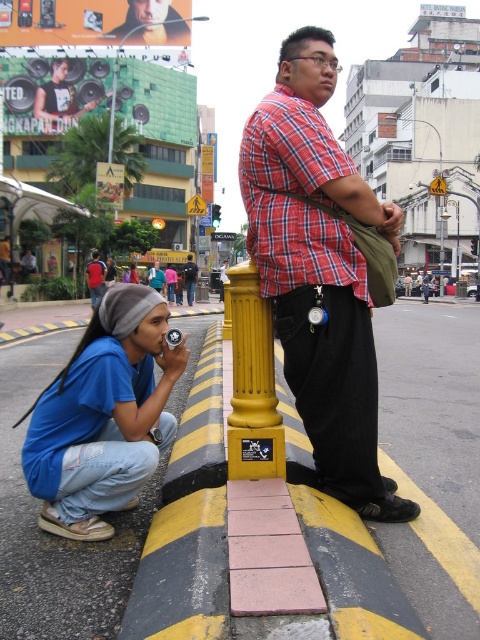
Does point (186, 424) come behind point (154, 266)?

No, it is in front of (154, 266).

Who is taller, yellow/black striped curb at lower left or blue denim jacket at lower left?

With more height is blue denim jacket at lower left.

You are a GUI agent. You are given a task and a screenshot of the screen. Output one action in this format:
    pyautogui.click(x=<x>, y=<y>)
    Task: Click on the yellow/black striped curb at lower left
    This screenshot has width=480, height=640.
    Given the screenshot: What is the action you would take?
    pyautogui.click(x=188, y=524)

Is pink fabric shirt at center thinner than denim jacket at lower left?

Incorrect, pink fabric shirt at center's width is not less than denim jacket at lower left's.

Who is positioned more to the right, pink fabric shirt at center or denim jacket at lower left?

denim jacket at lower left

Between point (171, 284) and point (136, 282), which one is positioned behind?

Point (136, 282)

Find the location of a particular element. The height and width of the screenshot is (640, 480). pink fabric shirt at center is located at coordinates (170, 282).

Can you confirm if matte red shirt at center is taller than denim jacket at lower left?

Indeed, matte red shirt at center has a greater height compared to denim jacket at lower left.

Is matte red shirt at center bigger than denim jacket at lower left?

Yes.

Who is more distant from viewer, (x=196, y=273) or (x=136, y=280)?

Point (x=136, y=280)

Where is `matte red shirt at center`? The image size is (480, 640). matte red shirt at center is located at coordinates (190, 276).